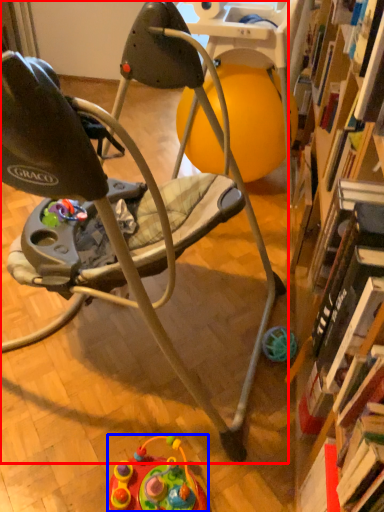
Question: Which point is closer to the camera, chair (highlighted by a red box) or toy (highlighted by a blue box)?

Choices:
 (A) chair
 (B) toy

Answer: (A)